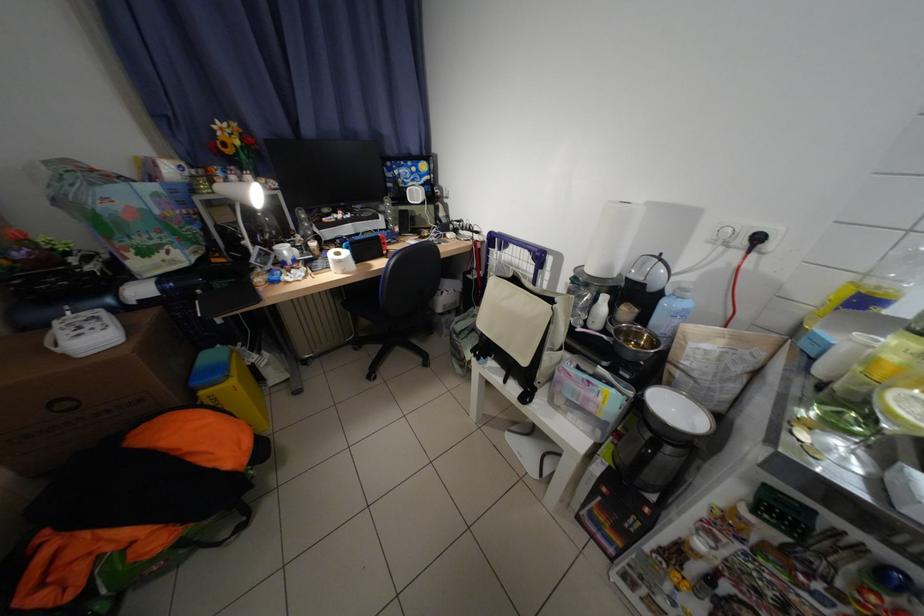
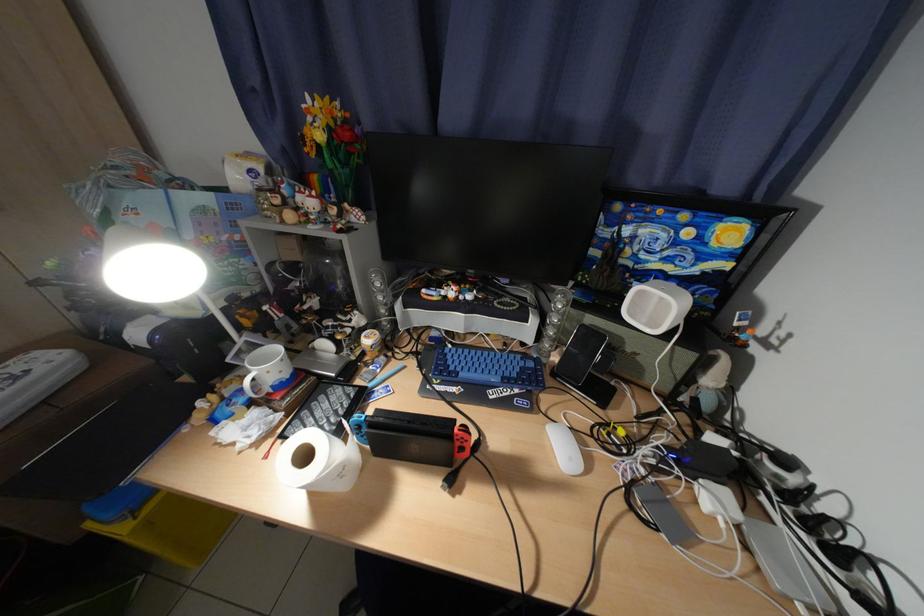
Find the pixel in the second image that matches pixel 321 278 in the first image.

(282, 444)